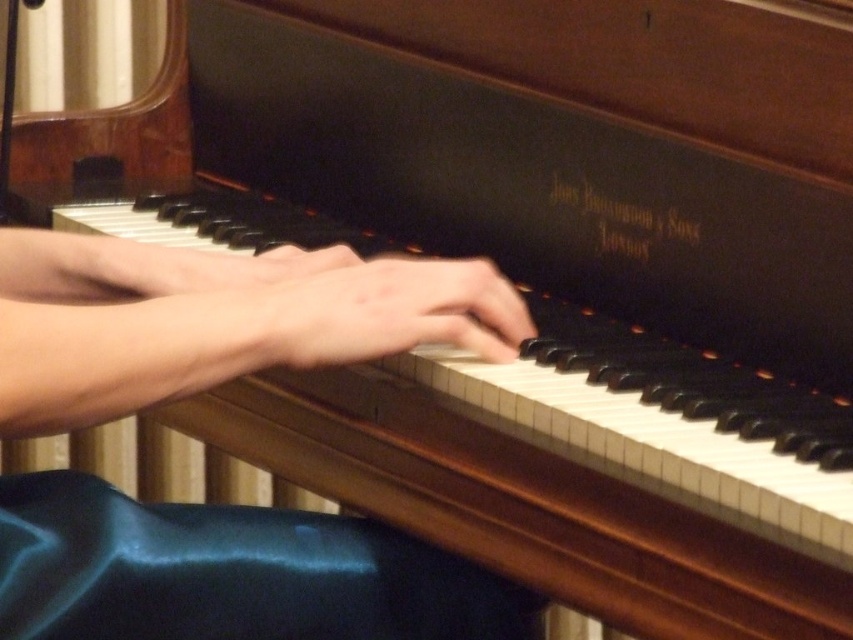
You are a photographer adjusting the lighting for a closeup shot of a piano player. You notice two hands in the frame, the smooth skin hands at center and the smooth skin hand at center. Which hand or hands take up more space horizontally in the image?

The smooth skin hands at center take up more horizontal space than the smooth skin hand at center because their width surpasses the latter.

You are a photographer adjusting the lighting for a piano performance photo. The scene includes a piano with its lid open, showing the brand name inscribed inside. You notice a point at coordinates [215,320] on your camera screen. Based on the scene description, what object or feature does this point likely represent?

The point at coordinates [215,320] corresponds to the smooth skin hands at center, which are the hands of the person playing the piano.